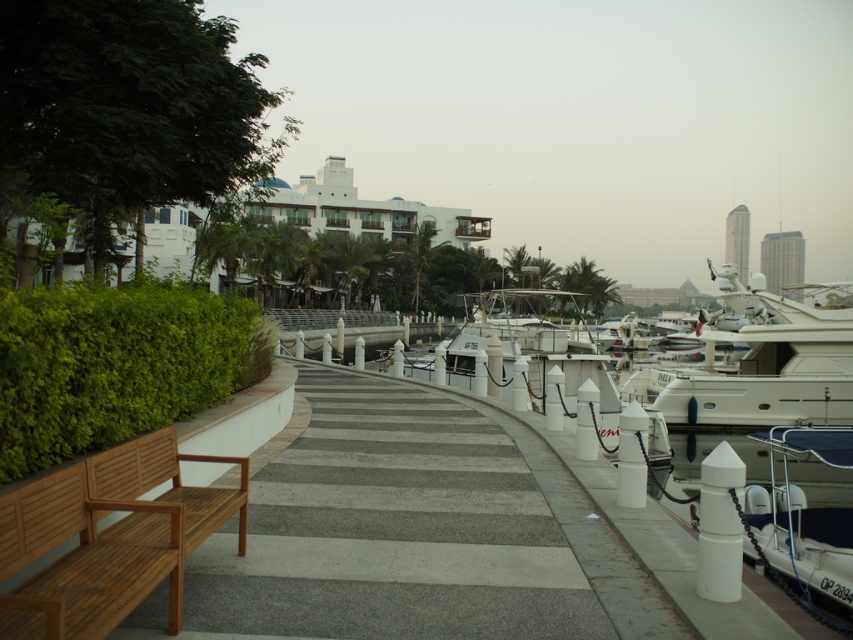
You are planning to host a small gathering at the waterfront. You have a teak wood bench at lower left and a white glossy boat at right available. Which object can accommodate more people sitting comfortably?

The white glossy boat at right can accommodate more people sitting comfortably since it has a larger size compared to the teak wood bench at lower left.

You are a visitor at the waterfront and want to take a photo of the white glossy boat at right while sitting on the teak wood bench at lower left. Can you see the boat from the bench?

The teak wood bench at lower left is to the left of the white glossy boat at right, so yes, the visitor can see the boat from the bench as they are positioned in a way that allows visibility between them.

You are standing at the center of the curved walkway in the waterfront scene. You want to sit on the teak wood bench at lower left. Which direction should you walk to reach it?

The teak wood bench at lower left is located at coordinates (x=107, y=538), so you should walk towards the lower left direction to reach it.